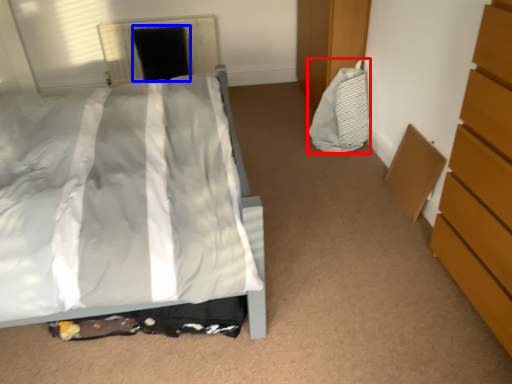
Question: Which object is closer to the camera taking this photo, material (highlighted by a red box) or screen door (highlighted by a blue box)?

Choices:
 (A) material
 (B) screen door

Answer: (A)